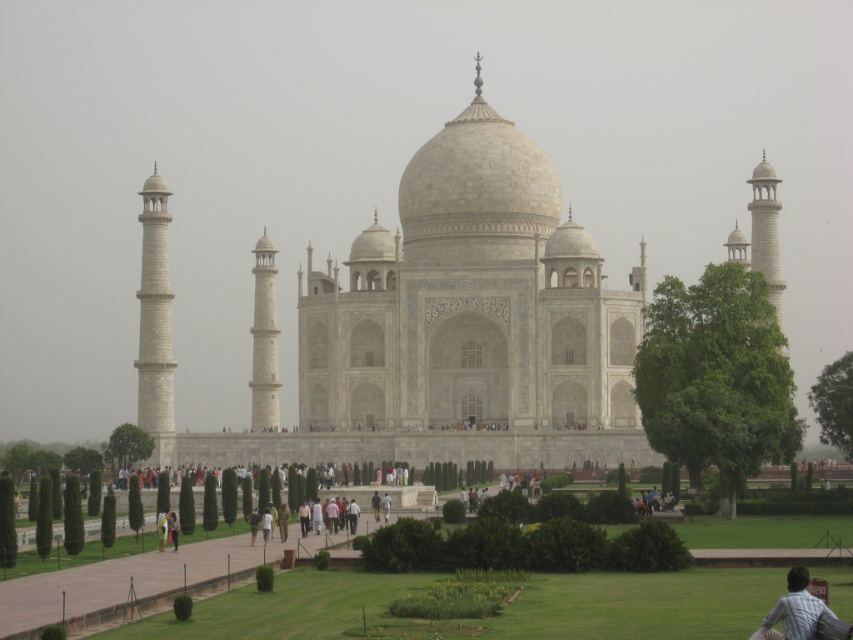
Is green grass at center above light brown striped shirt at lower right?

No.

Does point (535, 627) come in front of point (805, 582)?

No, it is not.

Between point (728, 625) and point (796, 588), which one is positioned behind?

The point (728, 625) is behind.

Find the location of `green grass at center`. green grass at center is located at coordinates (483, 620).

Which is more to the left, white marble taj mahal at center or light brown striped shirt at lower right?

white marble taj mahal at center is more to the left.

Between white marble taj mahal at center and light brown striped shirt at lower right, which one has less height?

light brown striped shirt at lower right

This screenshot has height=640, width=853. Describe the element at coordinates (428, 326) in the screenshot. I see `white marble taj mahal at center` at that location.

Locate an element on the screen. The image size is (853, 640). white marble taj mahal at center is located at coordinates (428, 326).

Does white marble taj mahal at center have a larger size compared to green grass at center?

Correct, white marble taj mahal at center is larger in size than green grass at center.

Does white marble taj mahal at center have a greater height compared to green grass at center?

Indeed, white marble taj mahal at center has a greater height compared to green grass at center.

Which is behind, point (398, 200) or point (642, 625)?

The point (398, 200) is behind.

The width and height of the screenshot is (853, 640). What are the coordinates of `white marble taj mahal at center` in the screenshot? It's located at (428, 326).